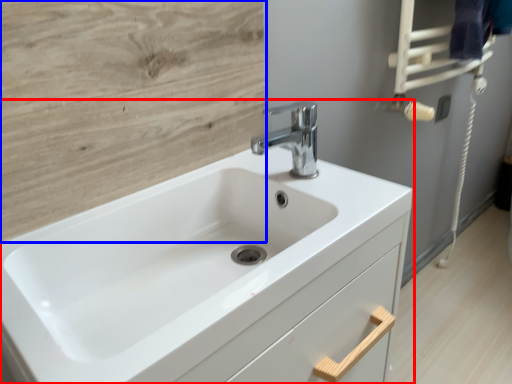
Question: Among these objects, which one is nearest to the camera, sink (highlighted by a red box) or plywood (highlighted by a blue box)?

Choices:
 (A) sink
 (B) plywood

Answer: (A)